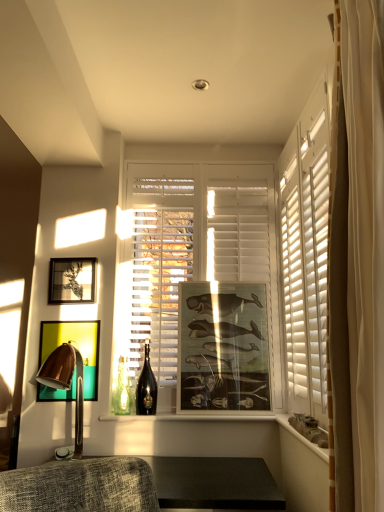
Question: From the image's perspective, is wooden ledge at lower right located above or below matte black picture frame at upper left, arranged as the 1th picture frame when viewed from the left?

Choices:
 (A) below
 (B) above

Answer: (A)

Question: Relative to matte black picture frame at upper left, the 3th picture frame in the right-to-left sequence, is wooden ledge at lower right in front or behind?

Choices:
 (A) front
 (B) behind

Answer: (A)

Question: Which of these objects is positioned farthest from the wooden ledge at lower right?

Choices:
 (A) metallic gold picture frame at left, which ranks as the 2th picture frame in right-to-left order
 (B) shiny dark glass bottle at center
 (C) white matte window at center
 (D) white glossy window sill at center
 (E) copper metallic table lamp at left

Answer: (A)

Question: Which of these objects is positioned farthest from the white matte window at center?

Choices:
 (A) copper metallic table lamp at left
 (B) matte black picture frame at upper left, the 3th picture frame in the right-to-left sequence
 (C) wooden ledge at lower right
 (D) shiny dark glass bottle at center
 (E) white glossy window sill at center

Answer: (C)